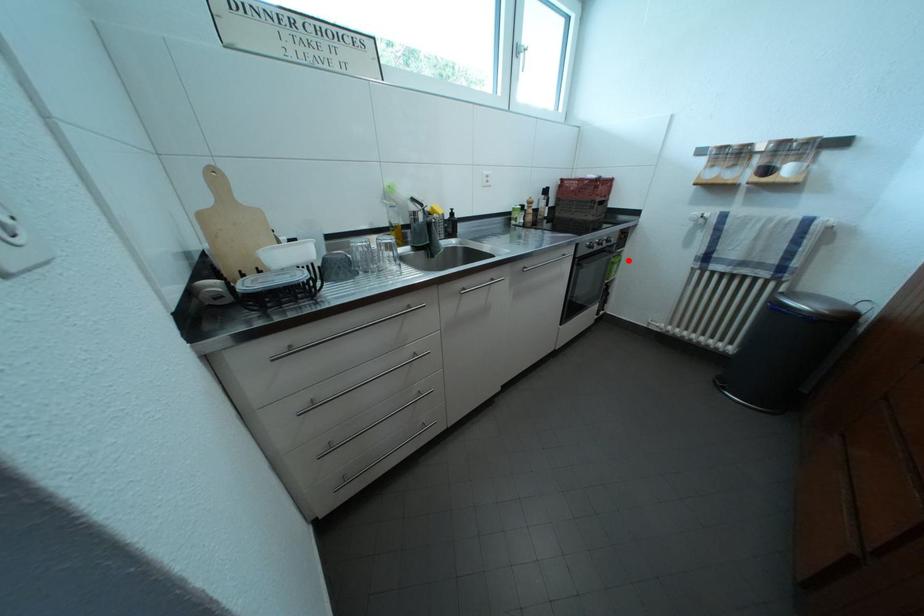
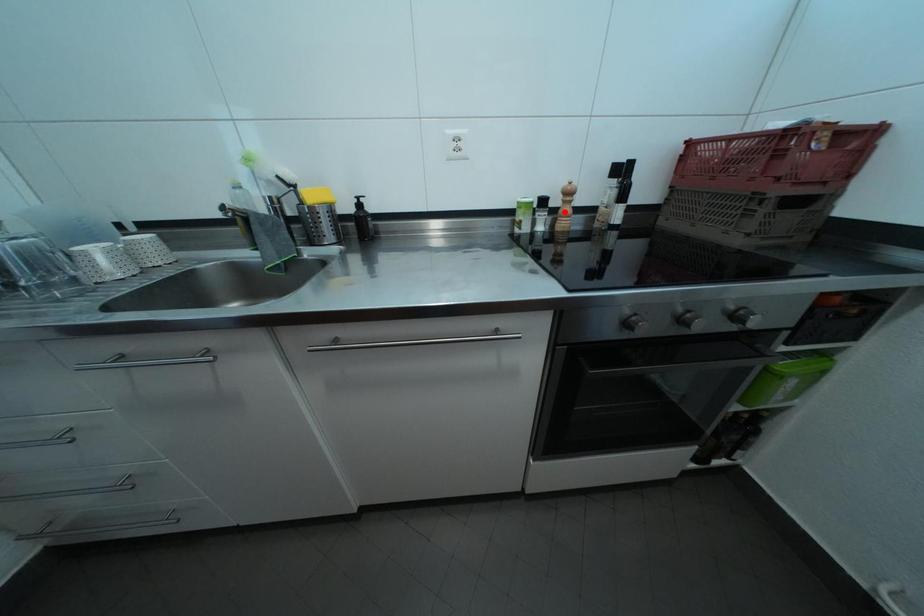
I am providing you with two images of the same scene from different viewpoints. A red point is marked on the first image and another point is marked on the second image. Is the marked point in image1 the same physical position as the marked point in image2?

No